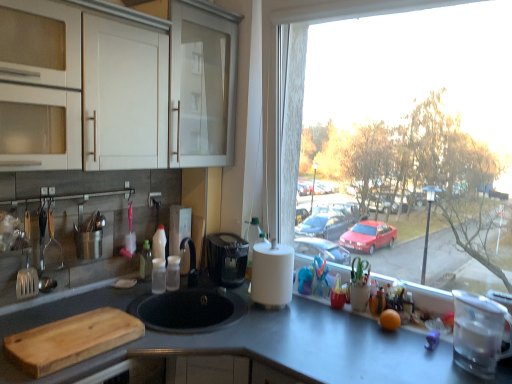
Identify the location of vacant area that is in front of transparent plastic bottle at sink. The image size is (512, 384). (129, 293).